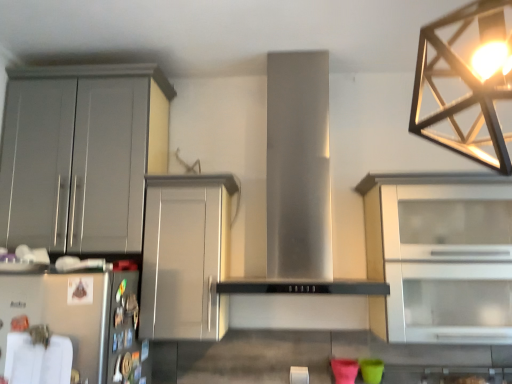
At what (x,y) coordinates should I click in order to perform the action: click on vacant space situated above stainless steel hood at center (from a real-world perspective). Please return your answer as a coordinate pair (x, y). Image resolution: width=512 pixels, height=384 pixels. Looking at the image, I should click on (304, 48).